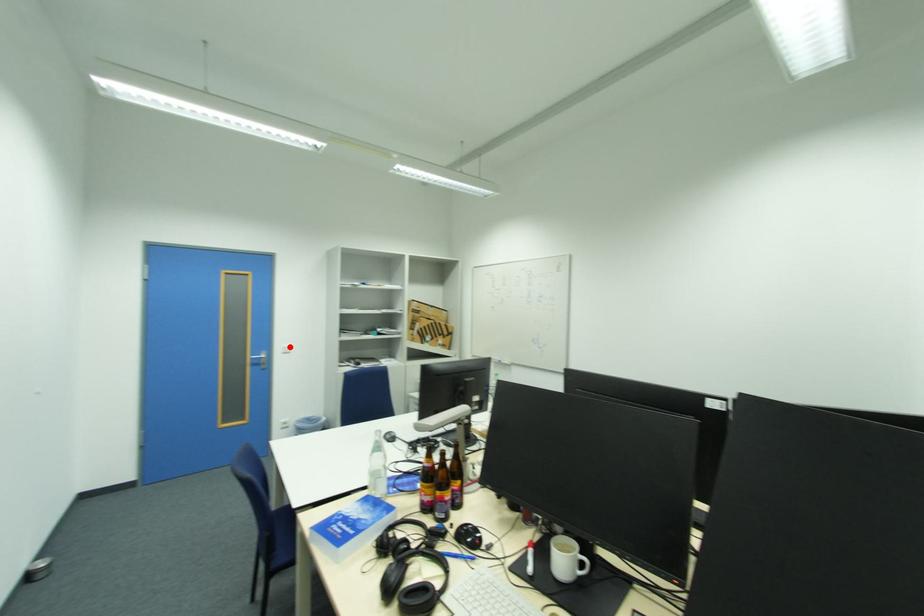
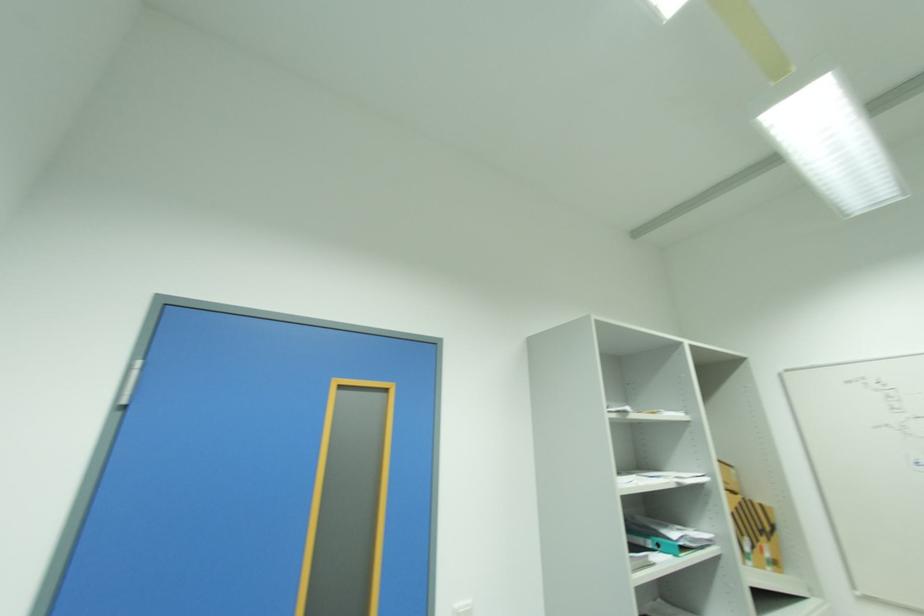
In the second image, find the point that corresponds to the highlighted location in the first image.

(463, 604)